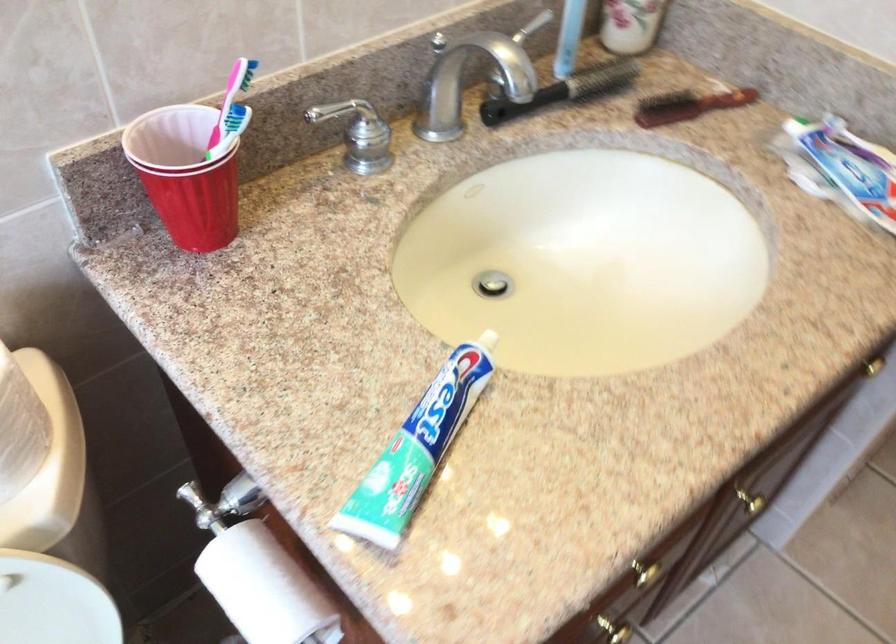
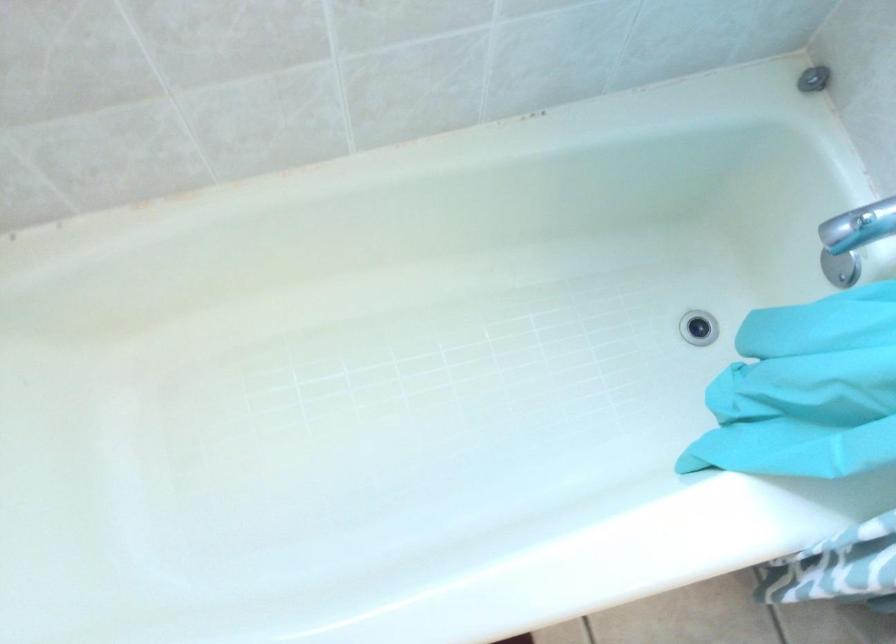
How did the camera likely rotate?

The camera's rotation is toward left-down.